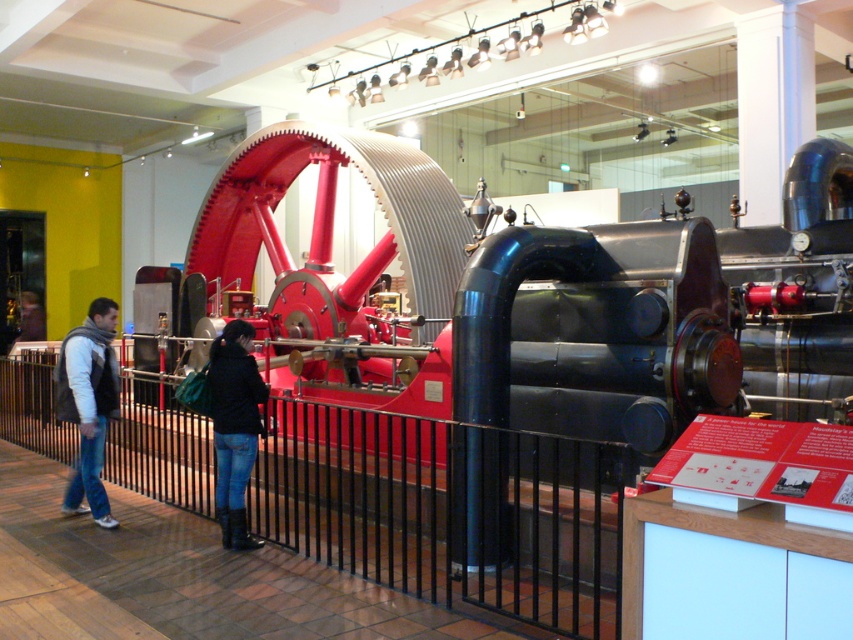
You are a visitor standing at the museum entrance and want to take a photo of the red polished metal steam engine at center without any people in the frame. The jeans at lower center belong to someone blocking your view. How can you adjust your position to avoid them?

Since the red polished metal steam engine at center is closer to the viewer than the jeans at lower center, you can move sideways to either the left or right to position yourself so that the jeans at lower center are no longer blocking your view of the engine.

In the scene shown: You are standing in the museum and want to take a photo of the engine. You notice two points marked in the image. The first point is at coordinate point (103, 500) and the second is at point (258, 372). If you want to focus on the closer point to the camera, which coordinate should you aim your camera at?

Point (103, 500) is further to the camera than point (258, 372). Therefore, to focus on the closer point to the camera, you should aim your camera at point (258, 372).